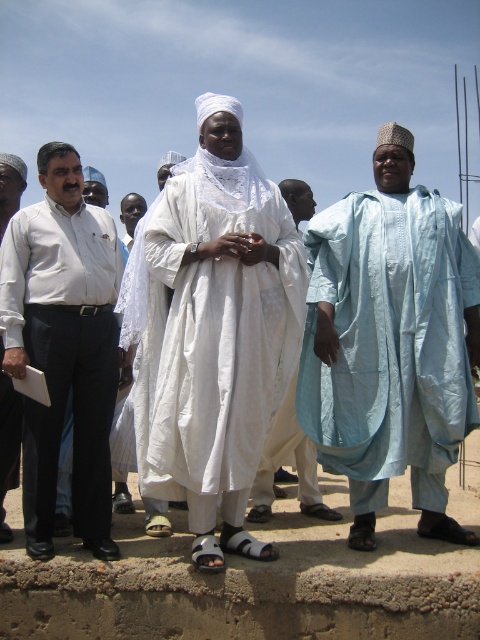
Who is taller, light blue fabric at center or white shirt at left?

light blue fabric at center

Who is higher up, light blue fabric at center or white shirt at left?

light blue fabric at center is above.

Which is in front, point (374, 227) or point (88, 321)?

Point (88, 321) is in front.

You are a GUI agent. You are given a task and a screenshot of the screen. Output one action in this format:
    pyautogui.click(x=<x>, y=<y>)
    Task: Click on the light blue fabric at center
    The image size is (480, 640).
    Given the screenshot: What is the action you would take?
    pyautogui.click(x=391, y=340)

Is the position of white cotton robe at center more distant than that of white matte shirt at left?

Yes, white cotton robe at center is behind white matte shirt at left.

Can you confirm if white cotton robe at center is positioned below white matte shirt at left?

Indeed, white cotton robe at center is positioned under white matte shirt at left.

What are the coordinates of `white cotton robe at center` in the screenshot? It's located at (288, 464).

Which of these two, light blue fabric at center or white cotton robe at center, stands taller?

light blue fabric at center is taller.

Is light blue fabric at center further to the viewer compared to white cotton robe at center?

No, light blue fabric at center is closer to the viewer.

Where is `light blue fabric at center`? light blue fabric at center is located at coordinates (391, 340).

Identify the location of light blue fabric at center. The image size is (480, 640). (391, 340).